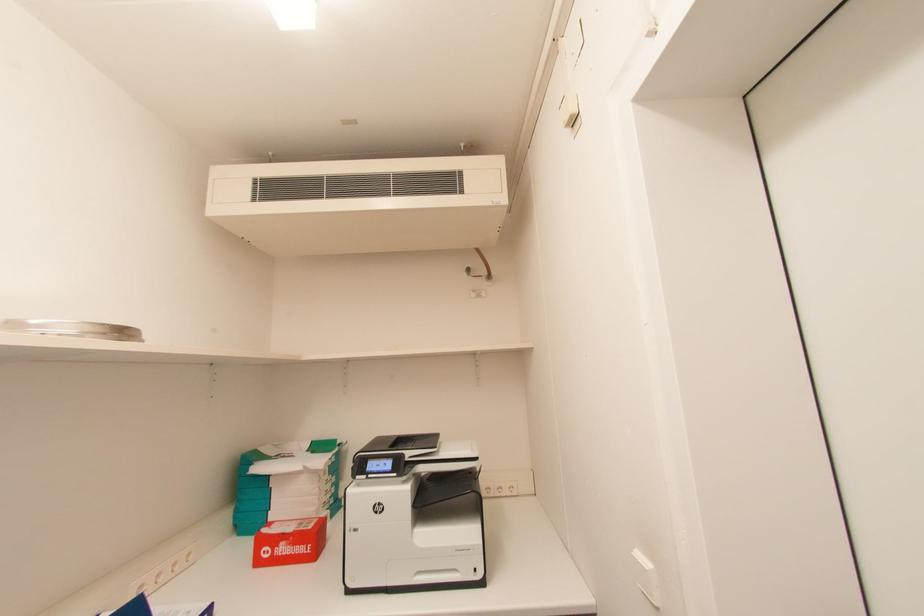
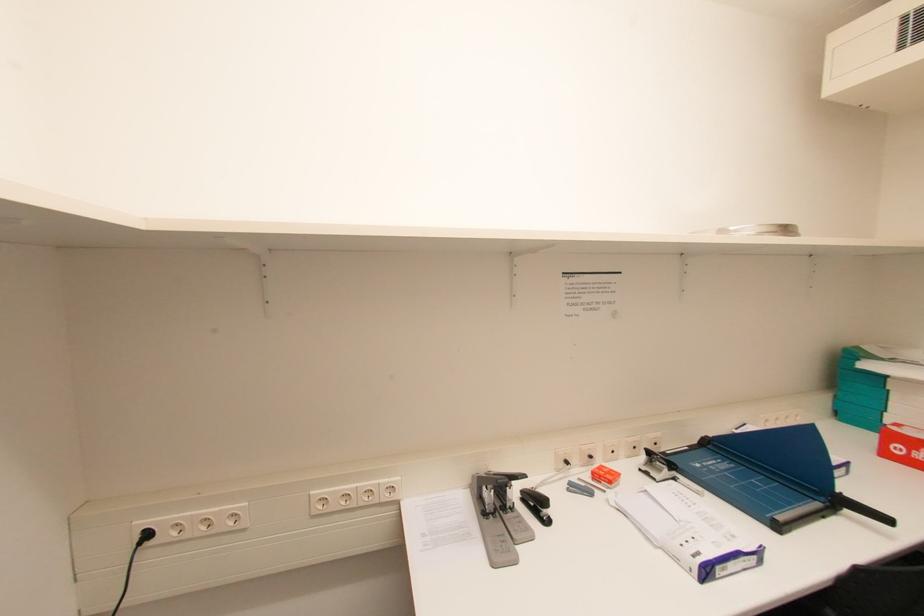
Question: The images are taken continuously from a first-person perspective. In which direction is your viewpoint rotating?

Choices:
 (A) Left
 (B) Right
 (C) Up
 (D) Down

Answer: (A)